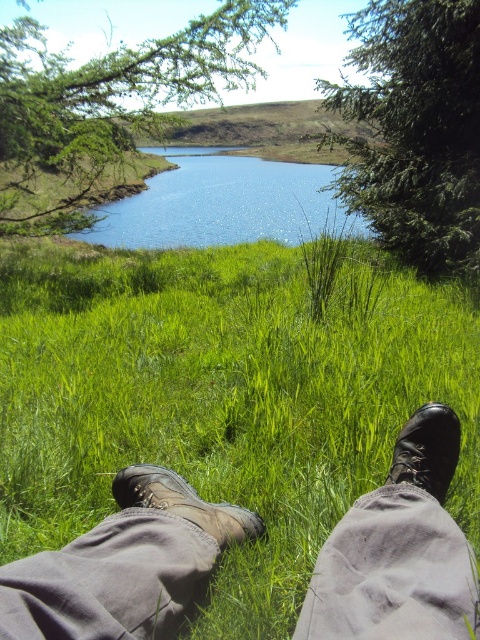
Does blue glassy water at center have a lesser height compared to brown leather boot at lower center?

No.

Does blue glassy water at center have a greater width compared to brown leather boot at lower center?

Yes, blue glassy water at center is wider than brown leather boot at lower center.

Does point (96, 228) come in front of point (228, 504)?

No, (96, 228) is further to viewer.

Find the location of a particular element. The height and width of the screenshot is (640, 480). blue glassy water at center is located at coordinates (223, 204).

Where is `leather boots at lower center`? The height and width of the screenshot is (640, 480). leather boots at lower center is located at coordinates (124, 564).

The width and height of the screenshot is (480, 640). What do you see at coordinates (124, 564) in the screenshot? I see `leather boots at lower center` at bounding box center [124, 564].

Which is in front, point (442, 413) or point (242, 205)?

Point (442, 413)

What are the coordinates of `leather boots at lower center` in the screenshot? It's located at (124, 564).

Who is positioned more to the left, blue glassy water at center or black leather boot at lower right?

From the viewer's perspective, blue glassy water at center appears more on the left side.

Is point (245, 225) behind point (440, 456)?

That is True.

The height and width of the screenshot is (640, 480). I want to click on blue glassy water at center, so click(x=223, y=204).